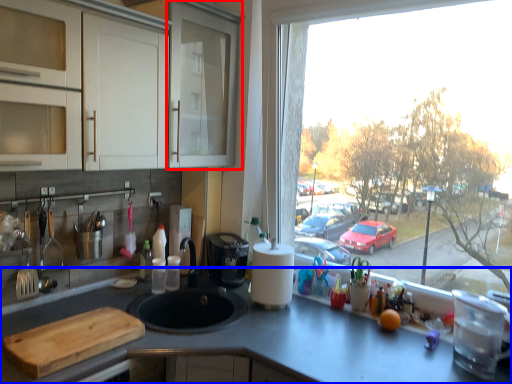
Question: Which of the following is the farthest to the observer, screen door (highlighted by a red box) or countertop (highlighted by a blue box)?

Choices:
 (A) screen door
 (B) countertop

Answer: (A)